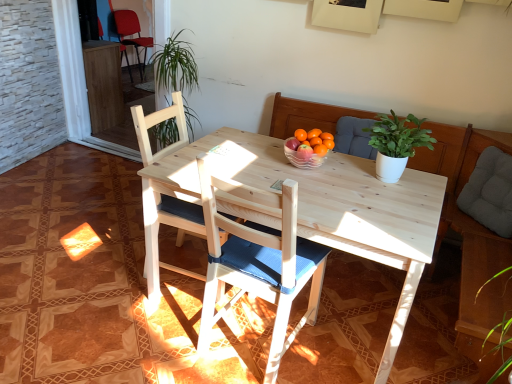
Question: Should I look upward or downward to see wooden chair at center, marked as the second chair in a back-to-front arrangement?

Choices:
 (A) up
 (B) down

Answer: (B)

Question: Considering the relative sizes of matte red chair at upper left, the third chair positioned from the right, and white matte plant at upper center in the image provided, is matte red chair at upper left, the third chair positioned from the right, wider than white matte plant at upper center?

Choices:
 (A) yes
 (B) no

Answer: (A)

Question: Is matte red chair at upper left, the 1th chair from the left, bigger than white matte plant at upper center?

Choices:
 (A) yes
 (B) no

Answer: (A)

Question: From the image's perspective, is matte red chair at upper left, the third chair in the front-to-back sequence, located above white matte plant at upper center?

Choices:
 (A) yes
 (B) no

Answer: (A)

Question: Can you confirm if matte red chair at upper left, the first chair positioned from the back, is shorter than white matte plant at upper center?

Choices:
 (A) no
 (B) yes

Answer: (A)

Question: From the image's perspective, would you say matte red chair at upper left, the first chair positioned from the back, is shown under white matte plant at upper center?

Choices:
 (A) yes
 (B) no

Answer: (B)

Question: Can you confirm if matte red chair at upper left, the third chair in the front-to-back sequence, is smaller than white matte plant at upper center?

Choices:
 (A) no
 (B) yes

Answer: (A)

Question: Is white matte plant at upper center further to camera compared to wooden chair at center, marked as the second chair in a back-to-front arrangement?

Choices:
 (A) yes
 (B) no

Answer: (B)

Question: Does white matte plant at upper center have a greater height compared to wooden chair at center, which is counted as the 2th chair, starting from the front?

Choices:
 (A) yes
 (B) no

Answer: (B)

Question: Is white matte plant at upper center to the left of wooden chair at center, which is counted as the 2th chair, starting from the front, from the viewer's perspective?

Choices:
 (A) yes
 (B) no

Answer: (B)

Question: Is white matte plant at upper center wider than wooden chair at center, which appears as the 2th chair when ordered from the bottom?

Choices:
 (A) no
 (B) yes

Answer: (A)

Question: From a real-world perspective, is white matte plant at upper center positioned over wooden chair at center, marked as the second chair in a back-to-front arrangement, based on gravity?

Choices:
 (A) yes
 (B) no

Answer: (A)

Question: From the image's perspective, would you say white matte plant at upper center is shown under wooden chair at center, which is counted as the 2th chair, starting from the front?

Choices:
 (A) yes
 (B) no

Answer: (B)

Question: Can wooden chair with blue cushion at center, which is the 1th chair in front-to-back order, be found inside matte red chair at upper left, the 3th chair ordered from the bottom?

Choices:
 (A) yes
 (B) no

Answer: (B)